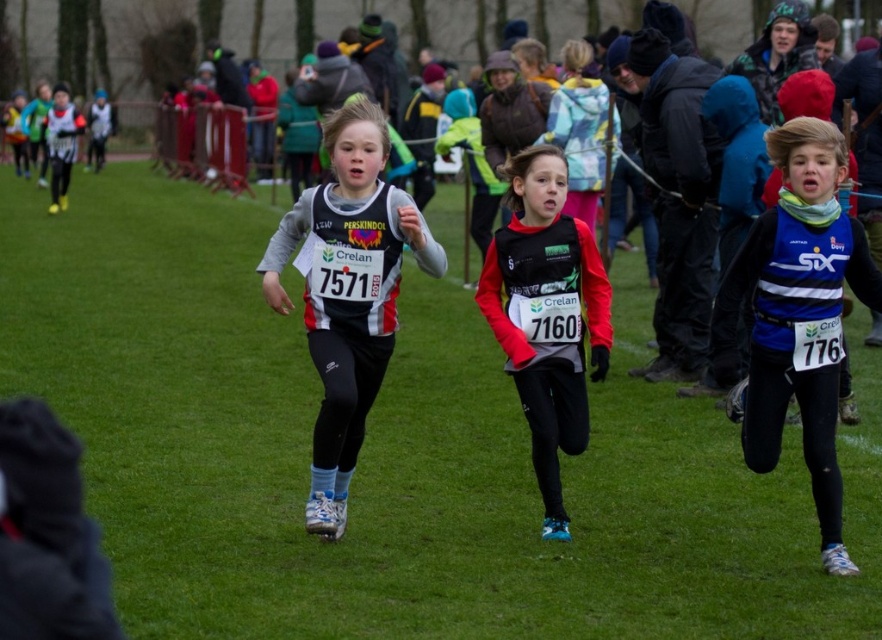
You are a photographer at the cross country race. You want to take a photo of the blue jersey at center and the black matte jacket at center. Based on their positions, which one is closer to the camera?

The blue jersey at center is in front of the black matte jacket at center, so it is closer to the camera.

You are a photographer positioned at the starting line of the cross country race. You want to take a photo that includes both the point at (746, 451) and the point at (363, 296). Which point will appear closer to the camera in the final photo?

Point at (746, 451) will appear closer to the camera because it is closer to the viewer than point at (363, 296).